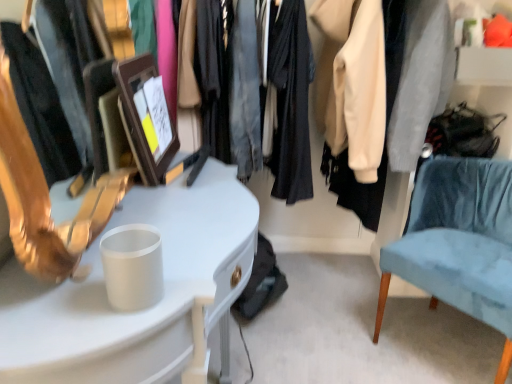
Describe the element at coordinates (459, 242) in the screenshot. The image size is (512, 384). I see `velvet blue chair at right` at that location.

This screenshot has height=384, width=512. Identify the location of velvet blue chair at right. (459, 242).

What do you see at coordinates (140, 311) in the screenshot? I see `white glossy desk at left` at bounding box center [140, 311].

What is the approximate width of white glossy desk at left?

It is 17.61 inches.

Where is `white glossy desk at left`? The height and width of the screenshot is (384, 512). white glossy desk at left is located at coordinates (140, 311).

Where is `velvet blue chair at right`? The height and width of the screenshot is (384, 512). velvet blue chair at right is located at coordinates (459, 242).

Is white glossy desk at left at the left side of velvet blue chair at right?

Indeed, white glossy desk at left is positioned on the left side of velvet blue chair at right.

Does white glossy desk at left lie behind velvet blue chair at right?

That is False.

Is point (194, 211) farther from viewer compared to point (455, 305)?

No.

From the image's perspective, is white glossy desk at left positioned above or below velvet blue chair at right?

white glossy desk at left is below velvet blue chair at right.

From a real-world perspective, is white glossy desk at left above or below velvet blue chair at right?

white glossy desk at left is situated higher than velvet blue chair at right in the real world.

Between white glossy desk at left and velvet blue chair at right, which one has larger width?

With larger width is velvet blue chair at right.

Does white glossy desk at left have a greater height compared to velvet blue chair at right?

Yes.

Considering the sizes of objects white glossy desk at left and velvet blue chair at right in the image provided, who is smaller, white glossy desk at left or velvet blue chair at right?

With smaller size is velvet blue chair at right.

Which is correct: white glossy desk at left is inside velvet blue chair at right, or outside of it?

white glossy desk at left is spatially situated outside velvet blue chair at right.

Are white glossy desk at left and velvet blue chair at right far apart?

white glossy desk at left is near velvet blue chair at right, not far away.

Could you tell me if white glossy desk at left is facing velvet blue chair at right?

Yes, white glossy desk at left is aimed at velvet blue chair at right.

Can you tell me how much white glossy desk at left and velvet blue chair at right differ in facing direction?

The facing directions of white glossy desk at left and velvet blue chair at right are 140 degrees apart.

Where is `chair on the right side of white glossy desk at left`? This screenshot has height=384, width=512. chair on the right side of white glossy desk at left is located at coordinates (459, 242).

Which object is positioned more to the right, velvet blue chair at right or white glossy desk at left?

velvet blue chair at right.

Between velvet blue chair at right and white glossy desk at left, which one is positioned behind?

velvet blue chair at right is further from the camera.

Does point (437, 182) appear closer or farther from the camera than point (132, 337)?

Point (437, 182) is positioned farther from the camera compared to point (132, 337).

From the image's perspective, is velvet blue chair at right under white glossy desk at left?

Actually, velvet blue chair at right appears above white glossy desk at left in the image.

From a real-world perspective, is velvet blue chair at right above or below white glossy desk at left?

In terms of real-world spatial position, velvet blue chair at right is below white glossy desk at left.

Considering the sizes of objects velvet blue chair at right and white glossy desk at left in the image provided, who is wider, velvet blue chair at right or white glossy desk at left?

Wider between the two is velvet blue chair at right.

Considering the relative sizes of velvet blue chair at right and white glossy desk at left in the image provided, is velvet blue chair at right taller than white glossy desk at left?

No, velvet blue chair at right is not taller than white glossy desk at left.

Who is smaller, velvet blue chair at right or white glossy desk at left?

velvet blue chair at right.

Is velvet blue chair at right located outside white glossy desk at left?

velvet blue chair at right lies outside white glossy desk at left's area.

Are velvet blue chair at right and white glossy desk at left located far from each other?

No, there isn't a large distance between velvet blue chair at right and white glossy desk at left.

Is velvet blue chair at right facing towards white glossy desk at left?

Yes, velvet blue chair at right is oriented towards white glossy desk at left.

Locate an element on the screen. desk on the left of velvet blue chair at right is located at coordinates tap(140, 311).

Identify the location of desk on the left of velvet blue chair at right. The height and width of the screenshot is (384, 512). (140, 311).

Where is `desk in front of the velvet blue chair at right`? This screenshot has height=384, width=512. desk in front of the velvet blue chair at right is located at coordinates (140, 311).